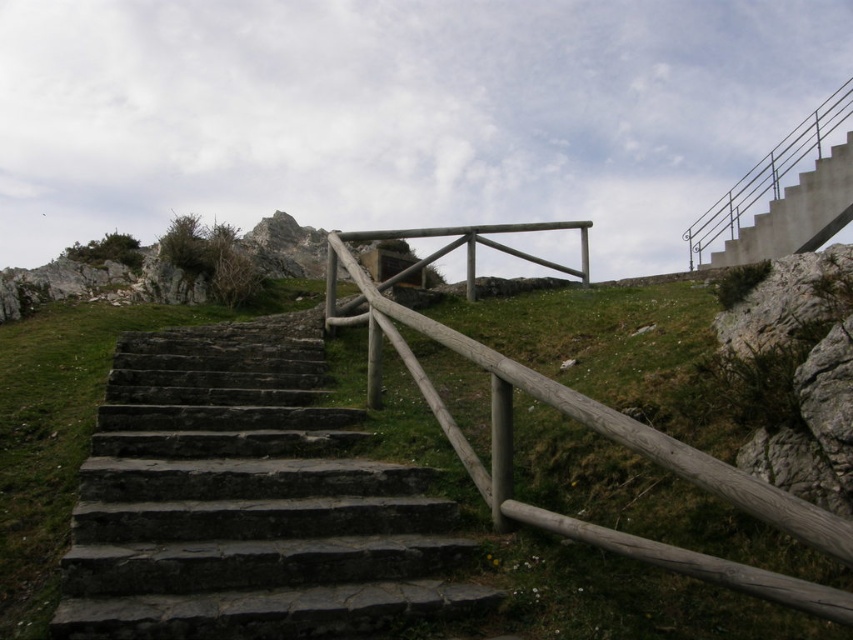
Is dark gray stone stairs at center positioned before concrete/stone stairs at upper right?

Yes.

Based on the photo, who is lower down, dark gray stone stairs at center or concrete/stone stairs at upper right?

dark gray stone stairs at center

This screenshot has width=853, height=640. What do you see at coordinates (247, 500) in the screenshot? I see `dark gray stone stairs at center` at bounding box center [247, 500].

Identify the location of dark gray stone stairs at center. (247, 500).

Does dark gray stone stairs at center lie in front of wooden rail at center?

No, it is not.

What are the coordinates of `dark gray stone stairs at center` in the screenshot? It's located at (247, 500).

At what (x,y) coordinates should I click in order to perform the action: click on dark gray stone stairs at center. Please return your answer as a coordinate pair (x, y). This screenshot has width=853, height=640. Looking at the image, I should click on (247, 500).

Is point (500, 397) positioned behind point (759, 225)?

No, it is not.

Does wooden rail at center appear over concrete/stone stairs at upper right?

No, wooden rail at center is not above concrete/stone stairs at upper right.

This screenshot has height=640, width=853. I want to click on wooden rail at center, so click(595, 432).